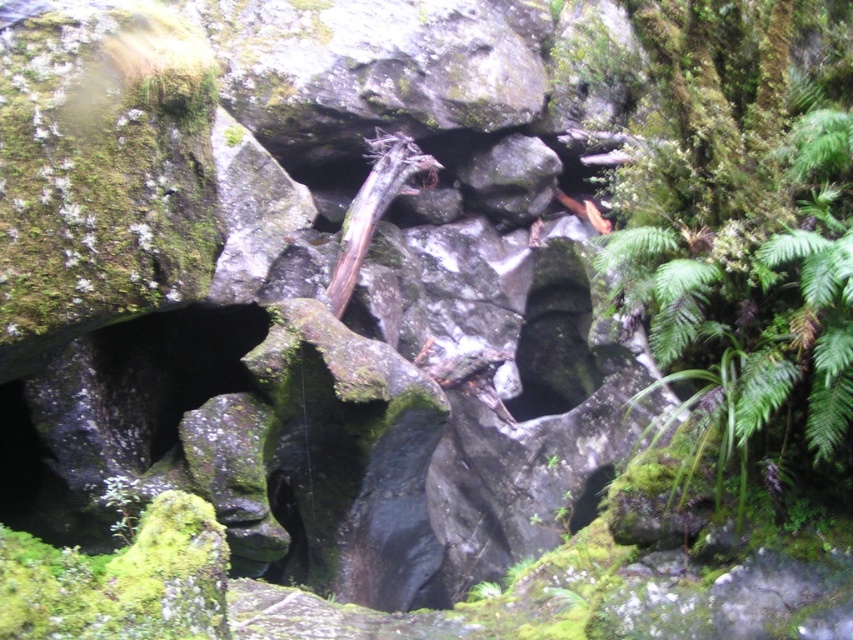
Which of these two, green mossy plant at right or brown rough tree trunk at center, stands taller?

green mossy plant at right

Is green mossy plant at right positioned at the back of brown rough tree trunk at center?

No, it is not.

Does point (756, 192) come in front of point (376, 132)?

That is True.

Where is `green mossy plant at right`? green mossy plant at right is located at coordinates (747, 236).